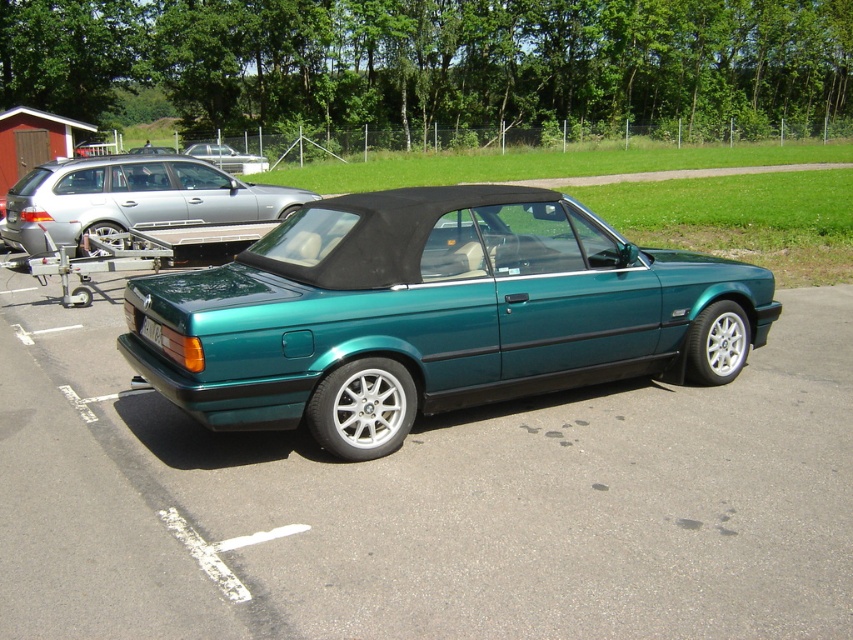
You are standing at the center of the parking lot and want to locate the teal metallic convertible at center. According to the coordinates provided, where exactly is it positioned relative to your current position?

The teal metallic convertible at center is positioned at coordinates point (x=434, y=314), which is very close to the center of the parking lot.

You are standing in a parking lot and see two cars labeled as metallic teal car at center and teal metallic car at center. Which one is positioned to the right side?

The metallic teal car at center is positioned to the right of the teal metallic car at center.

You are a photographer setting up a shoot for a car magazine. You have two cars in front of you, the metallic teal car at center and the teal metallic car at center. The editor wants to know which one is narrower for a tight parking space feature. Which car should you recommend?

The metallic teal car at center is thinner than the teal metallic car at center, so it is narrower and better suited for the tight parking space feature.